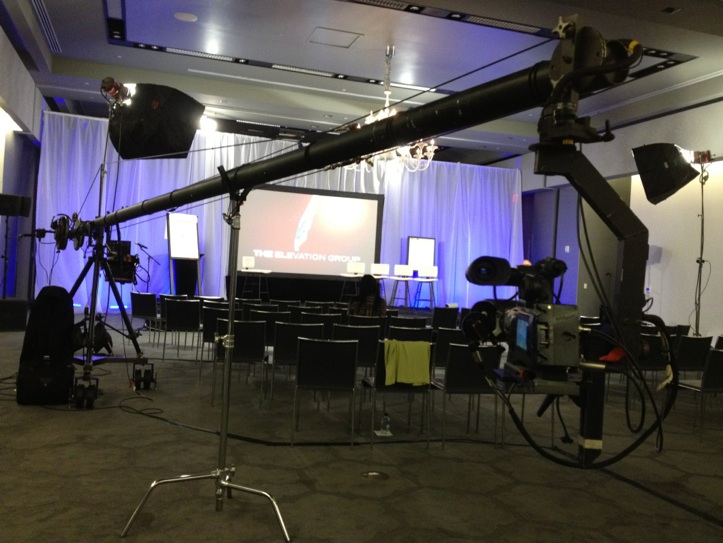
Where is `ceiling`? The height and width of the screenshot is (543, 723). ceiling is located at coordinates (419, 59).